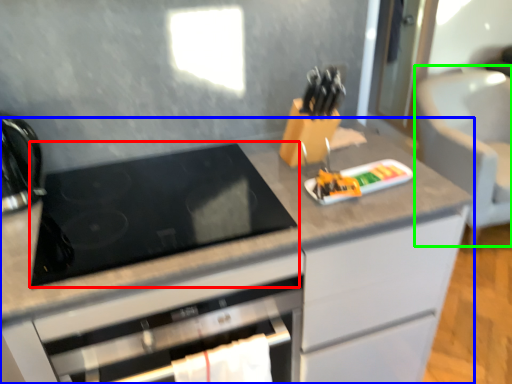
Question: Based on their relative distances, which object is farther from gas stove (highlighted by a red box)? Choose from cabinetry (highlighted by a blue box) and armchair (highlighted by a green box).

Choices:
 (A) cabinetry
 (B) armchair

Answer: (B)